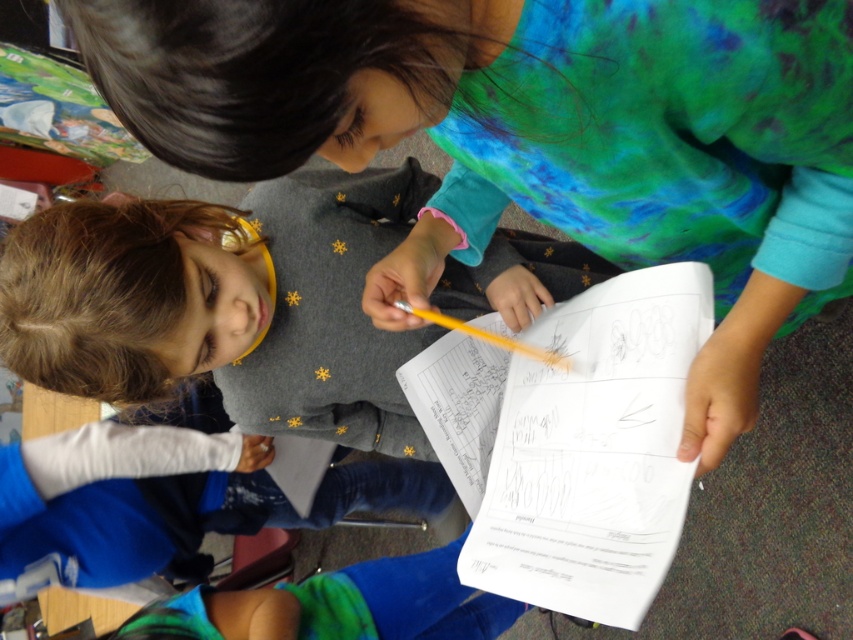
Question: Among these points, which one is farthest from the camera?

Choices:
 (A) (314, 394)
 (B) (137, 625)

Answer: (B)

Question: Where is matte gray sweater at center located in relation to gray sweater at center in the image?

Choices:
 (A) above
 (B) below

Answer: (A)

Question: Can you confirm if matte gray sweater at center is bigger than blue fabric pants at lower center?

Choices:
 (A) no
 (B) yes

Answer: (A)

Question: Which point is closer to the camera?

Choices:
 (A) (318, 173)
 (B) (32, 493)

Answer: (A)

Question: Can you confirm if gray sweater at center is positioned below blue-green fleece pants at lower center?

Choices:
 (A) yes
 (B) no

Answer: (B)

Question: Which point is closer to the camera?

Choices:
 (A) gray sweater at center
 (B) blue-green fleece pants at lower center
 (C) blue fabric pants at lower center
 (D) matte gray sweater at center

Answer: (D)